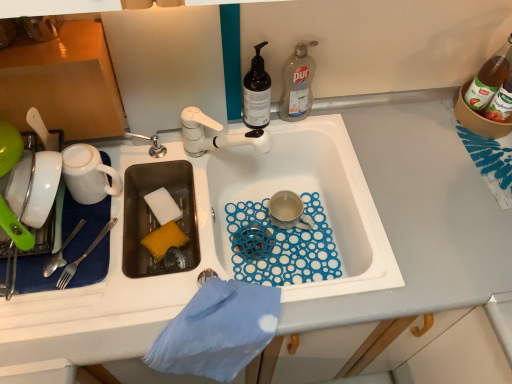
This screenshot has width=512, height=384. What do you see at coordinates (82, 257) in the screenshot?
I see `satin silver fork at left` at bounding box center [82, 257].

Find the location of a particular element. The width and height of the screenshot is (512, 384). shiny silver fork at left is located at coordinates (60, 253).

The height and width of the screenshot is (384, 512). I want to click on satin silver fork at left, so click(82, 257).

You are a GUI agent. You are given a task and a screenshot of the screen. Output one action in this format:
    pyautogui.click(x=<x>, y=<y>)
    Task: Click on the silverware above the yellow sponge at sink left, which is the second food in top-to-bottom order (from a real-world perspective)
    
    Given the screenshot: What is the action you would take?
    pyautogui.click(x=60, y=253)

Consider the image. In the image, is yellow sponge at sink left, the 1th food from the bottom, positioned in front of or behind shiny silver fork at left?

yellow sponge at sink left, the 1th food from the bottom, is behind shiny silver fork at left.

From a real-world perspective, is yellow sponge at sink left, which is the second food in top-to-bottom order, above or below shiny silver fork at left?

In terms of real-world spatial position, yellow sponge at sink left, which is the second food in top-to-bottom order, is below shiny silver fork at left.

Which is in front, point (166, 249) or point (64, 245)?

The point (64, 245) is in front.

Based on the photo, which is more to the left, translucent dark brown bottle at upper center, the third bottle in the right-to-left sequence, or clear plastic bottle at upper right, marked as the second bottle in a right-to-left arrangement?

From the viewer's perspective, translucent dark brown bottle at upper center, the third bottle in the right-to-left sequence, appears more on the left side.

In the image, there is a translucent dark brown bottle at upper center, the first bottle when ordered from left to right. Identify the location of bottle below it (from a real-world perspective). (297, 84).

Between point (257, 75) and point (296, 114), which one is positioned in front?

The point (257, 75) is closer.

The height and width of the screenshot is (384, 512). Identify the location of the 2nd coffee cup positioned above the white plastic sink at center (from a real-world perspective). (88, 174).

From the image's perspective, does white matte mug at upper left, the first coffee cup viewed from the left, appear lower than white plastic sink at center?

No, from the image's perspective, white matte mug at upper left, the first coffee cup viewed from the left, is not beneath white plastic sink at center.

Which object is more forward, white matte mug at upper left, marked as the 2th coffee cup in a back-to-front arrangement, or white plastic sink at center?

white plastic sink at center is in front.

Is yellow sponge at sink left, which is the second food in top-to-bottom order, behind clear plastic bottle at upper right, marked as the second bottle in a right-to-left arrangement?

That is True.

Measure the distance between yellow sponge at sink left, which is the second food in top-to-bottom order, and clear plastic bottle at upper right, marked as the second bottle in a right-to-left arrangement.

yellow sponge at sink left, which is the second food in top-to-bottom order, and clear plastic bottle at upper right, marked as the second bottle in a right-to-left arrangement, are 46.19 centimeters apart from each other.

Where is `the 1st food behind the clear plastic bottle at upper right, marked as the second bottle in a right-to-left arrangement`? the 1st food behind the clear plastic bottle at upper right, marked as the second bottle in a right-to-left arrangement is located at coordinates tap(164, 240).

Can you tell me how much yellow sponge at sink left, the 1th food from the bottom, and clear plastic bottle at upper right, positioned as the 2th bottle in left-to-right order, differ in facing direction?

26.1 degrees separate the facing orientations of yellow sponge at sink left, the 1th food from the bottom, and clear plastic bottle at upper right, positioned as the 2th bottle in left-to-right order.

Does point (176, 212) lie behind point (267, 73)?

Yes, it is behind point (267, 73).

Which of these two, white sponge at sink left, which appears as the first food when viewed from the top, or translucent dark brown bottle at upper center, the third bottle in the right-to-left sequence, is wider?

With larger width is white sponge at sink left, which appears as the first food when viewed from the top.

How many degrees apart are the facing directions of white sponge at sink left, arranged as the 2th food when ordered from the bottom, and translucent dark brown bottle at upper center, the first bottle when ordered from left to right?

22.2 degrees.

From a real-world perspective, relative to translucent dark brown bottle at upper center, the first bottle when ordered from left to right, is white sponge at sink left, which appears as the first food when viewed from the top, vertically above or below?

From a real-world perspective, white sponge at sink left, which appears as the first food when viewed from the top, is physically below translucent dark brown bottle at upper center, the first bottle when ordered from left to right.

Consider the image. Is the position of satin silver fork at left more distant than that of white sponge at sink left, which appears as the first food when viewed from the top?

No, it is not.

From the image's perspective, which one is positioned lower, satin silver fork at left or white sponge at sink left, arranged as the 2th food when ordered from the bottom?

satin silver fork at left appears lower in the image.

Based on the photo, considering the positions of objects satin silver fork at left and white sponge at sink left, which appears as the first food when viewed from the top, in the image provided, who is more to the left, satin silver fork at left or white sponge at sink left, which appears as the first food when viewed from the top,?

satin silver fork at left.

Considering the sizes of objects satin silver fork at left and white sponge at sink left, arranged as the 2th food when ordered from the bottom, in the image provided, who is bigger, satin silver fork at left or white sponge at sink left, arranged as the 2th food when ordered from the bottom,?

white sponge at sink left, arranged as the 2th food when ordered from the bottom, is bigger.

Does point (163, 237) come closer to viewer compared to point (251, 102)?

That is True.

The image size is (512, 384). What are the coordinates of `the 1st bottle above the yellow sponge at sink left, the 1th food from the bottom (from the image's perspective)` in the screenshot? It's located at (256, 93).

Measure the distance between yellow sponge at sink left, the 1th food from the bottom, and translucent dark brown bottle at upper center, the third bottle in the right-to-left sequence.

yellow sponge at sink left, the 1th food from the bottom, and translucent dark brown bottle at upper center, the third bottle in the right-to-left sequence, are 14.78 inches apart.

Is yellow sponge at sink left, the 1th food from the bottom, touching translucent dark brown bottle at upper center, the first bottle when ordered from left to right?

No.

Identify the location of the 1st food behind the shiny silver fork at left, starting your count from the anchor. (164, 240).

Locate an element on the screen. bottle that is on the left side of clear plastic bottle at upper right, marked as the second bottle in a right-to-left arrangement is located at coordinates (256, 93).

When comparing their distances from clear plastic bottle at upper right, marked as the second bottle in a right-to-left arrangement, does white plastic sink at center or matte ceramic mug at center, positioned as the 2th coffee cup in left-to-right order, seem further?

white plastic sink at center is positioned further to the anchor clear plastic bottle at upper right, marked as the second bottle in a right-to-left arrangement.

Which object lies further to the anchor point translucent glass bottle at upper right, the first bottle in the right-to-left sequence, translucent dark brown bottle at upper center, the third bottle in the right-to-left sequence, or yellow sponge at sink left, which is the second food in top-to-bottom order?

Based on the image, yellow sponge at sink left, which is the second food in top-to-bottom order, appears to be further to translucent glass bottle at upper right, the first bottle in the right-to-left sequence.

Based on their spatial positions, is yellow sponge at sink left, which is the second food in top-to-bottom order, or translucent dark brown bottle at upper center, the first bottle when ordered from left to right, further from white sponge at sink left, arranged as the 2th food when ordered from the bottom?

translucent dark brown bottle at upper center, the first bottle when ordered from left to right, is positioned further to the anchor white sponge at sink left, arranged as the 2th food when ordered from the bottom.

From the image, which object appears to be nearer to white sponge at sink left, arranged as the 2th food when ordered from the bottom, matte ceramic mug at center, the first coffee cup viewed from the right, or white plastic sink at center?

Based on the image, white plastic sink at center appears to be nearer to white sponge at sink left, arranged as the 2th food when ordered from the bottom.

Estimate the real-world distances between objects in this image. Which object is further from white sponge at sink left, arranged as the 2th food when ordered from the bottom, translucent glass bottle at upper right, placed as the third bottle when sorted from left to right, or translucent dark brown bottle at upper center, the first bottle when ordered from left to right?

Based on the image, translucent glass bottle at upper right, placed as the third bottle when sorted from left to right, appears to be further to white sponge at sink left, arranged as the 2th food when ordered from the bottom.

Considering their positions, is translucent glass bottle at upper right, placed as the third bottle when sorted from left to right, positioned further to white sponge at sink left, which appears as the first food when viewed from the top, than satin silver fork at left?

translucent glass bottle at upper right, placed as the third bottle when sorted from left to right.

Looking at the image, which one is located further to white sponge at sink left, which appears as the first food when viewed from the top, clear plastic bottle at upper right, marked as the second bottle in a right-to-left arrangement, or satin silver fork at left?

The object further to white sponge at sink left, which appears as the first food when viewed from the top, is clear plastic bottle at upper right, marked as the second bottle in a right-to-left arrangement.

From the image, which object appears to be farther from white matte mug at upper left, marked as the 2th coffee cup in a right-to-left arrangement, translucent glass bottle at upper right, placed as the third bottle when sorted from left to right, or matte ceramic mug at center, which ranks as the 2th coffee cup in front-to-back order?

Among the two, translucent glass bottle at upper right, placed as the third bottle when sorted from left to right, is located further to white matte mug at upper left, marked as the 2th coffee cup in a right-to-left arrangement.

Find the location of `coffee cup situated between white matte mug at upper left, the first coffee cup viewed from the left, and translucent glass bottle at upper right, the first bottle in the right-to-left sequence, from left to right`. coffee cup situated between white matte mug at upper left, the first coffee cup viewed from the left, and translucent glass bottle at upper right, the first bottle in the right-to-left sequence, from left to right is located at coordinates (288, 211).

Locate an element on the screen. sink between shiny silver fork at left and matte ceramic mug at center, which is the 1th coffee cup in back-to-front order is located at coordinates (227, 236).

Image resolution: width=512 pixels, height=384 pixels. Find the location of `coffee cup between shiny silver fork at left and matte ceramic mug at center, positioned as the 2th coffee cup in left-to-right order`. coffee cup between shiny silver fork at left and matte ceramic mug at center, positioned as the 2th coffee cup in left-to-right order is located at coordinates (88, 174).

Locate an element on the screen. bottle located between translucent dark brown bottle at upper center, the first bottle when ordered from left to right, and translucent glass bottle at upper right, the first bottle in the right-to-left sequence, in the left-right direction is located at coordinates (297, 84).